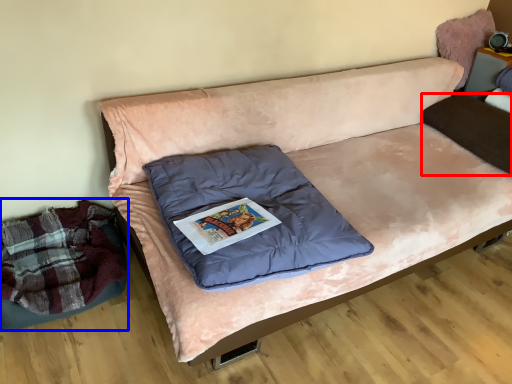
Question: Which object appears closest to the camera in this image, pillow (highlighted by a red box) or mattress (highlighted by a blue box)?

Choices:
 (A) pillow
 (B) mattress

Answer: (B)